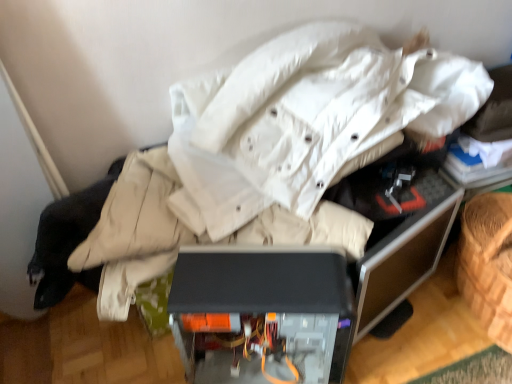
Question: In the image, is transparent plastic case at center positioned in front of or behind matte black computer case at center?

Choices:
 (A) front
 (B) behind

Answer: (B)

Question: In the image, is transparent plastic case at center on the left side or the right side of matte black computer case at center?

Choices:
 (A) left
 (B) right

Answer: (B)

Question: From a real-world perspective, is transparent plastic case at center above or below matte black computer case at center?

Choices:
 (A) below
 (B) above

Answer: (B)

Question: Considering the relative positions of matte black computer case at center and transparent plastic case at center in the image provided, is matte black computer case at center to the left or to the right of transparent plastic case at center?

Choices:
 (A) left
 (B) right

Answer: (A)

Question: Is matte black computer case at center situated inside transparent plastic case at center or outside?

Choices:
 (A) inside
 (B) outside

Answer: (B)

Question: Is matte black computer case at center wider or thinner than transparent plastic case at center?

Choices:
 (A) wide
 (B) thin

Answer: (A)

Question: Is point (x=380, y=258) positioned closer to the camera than point (x=261, y=301)?

Choices:
 (A) closer
 (B) farther

Answer: (B)